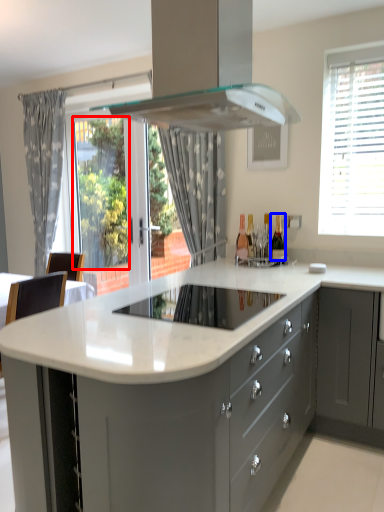
Question: Which object appears closest to the camera in this image, window screen (highlighted by a red box) or wine bottle (highlighted by a blue box)?

Choices:
 (A) window screen
 (B) wine bottle

Answer: (B)